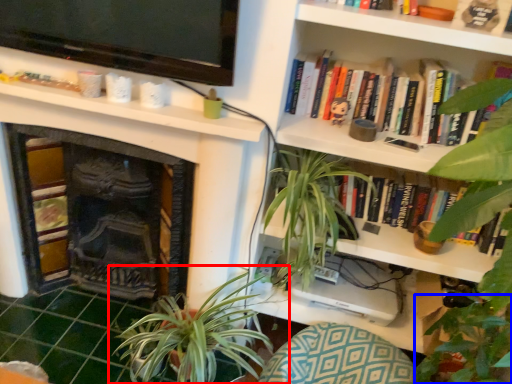
Question: Which object appears farthest to the camera in this image, houseplant (highlighted by a red box) or vegetation (highlighted by a blue box)?

Choices:
 (A) houseplant
 (B) vegetation

Answer: (B)